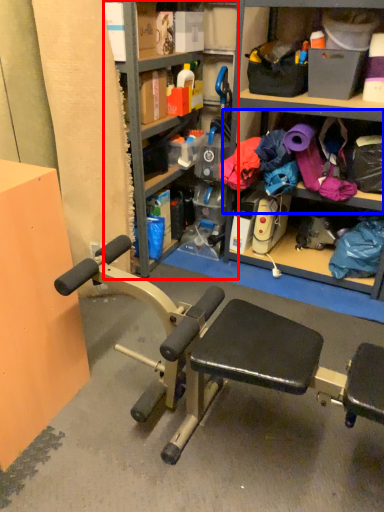
Question: Which object is further to the camera taking this photo, bookshelf (highlighted by a red box) or shelf (highlighted by a blue box)?

Choices:
 (A) bookshelf
 (B) shelf

Answer: (B)